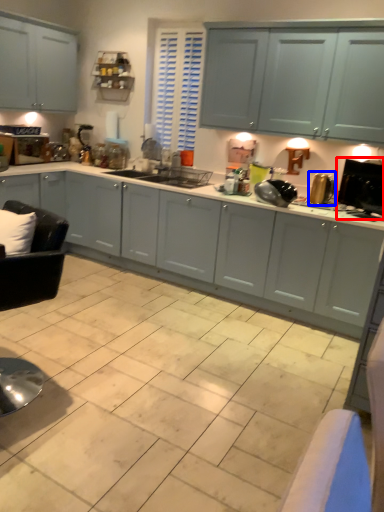
Question: Which object is further to the camera taking this photo, appliance (highlighted by a red box) or appliance (highlighted by a blue box)?

Choices:
 (A) appliance
 (B) appliance

Answer: (B)